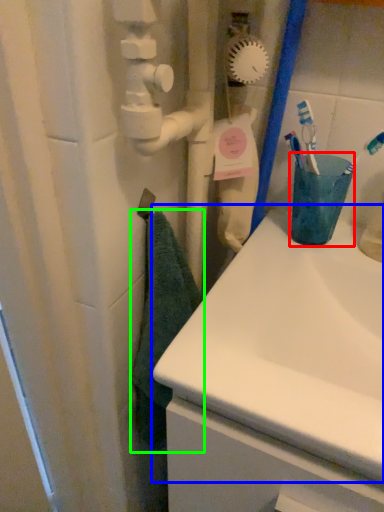
Question: Which object is positioned farthest from turquoise (highlighted by a red box)? Select from sink (highlighted by a blue box) and bath towel (highlighted by a green box).

Choices:
 (A) sink
 (B) bath towel

Answer: (B)